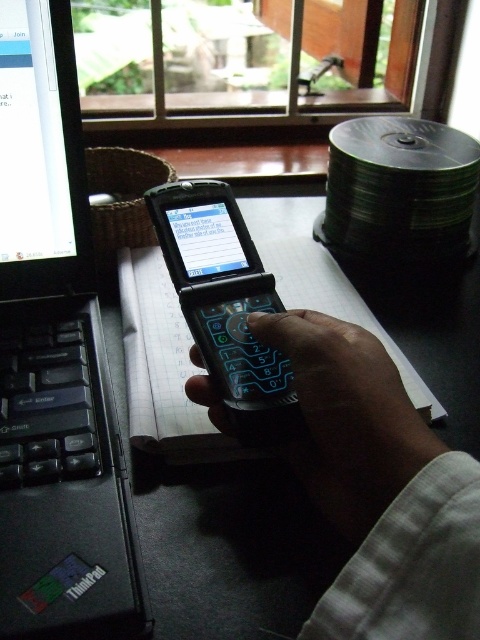
In the scene shown: Is black plastic laptop at left thinner than black plastic phone at center?

No, black plastic laptop at left is not thinner than black plastic phone at center.

Is black plastic laptop at left positioned behind black plastic phone at center?

No, black plastic laptop at left is in front of black plastic phone at center.

Is point (48, 246) behind point (232, 394)?

Yes, point (48, 246) is behind point (232, 394).

Identify the location of black plastic laptop at left. (55, 362).

Between black matte phone at center and black plastic table at center, which one is positioned lower?

black matte phone at center is below.

Consider the image. Which is more to the right, black matte phone at center or black plastic table at center?

black matte phone at center is more to the right.

Is point (321, 365) closer to viewer compared to point (151, 269)?

Yes.

Where is `black matte phone at center`? The image size is (480, 640). black matte phone at center is located at coordinates (348, 417).

Who is taller, black plastic laptop at left or black plastic table at center?

black plastic laptop at left

Does black plastic laptop at left appear on the right side of black plastic table at center?

No, black plastic laptop at left is not to the right of black plastic table at center.

Is point (80, 236) positioned after point (146, 429)?

Yes, point (80, 236) is farther from viewer.

You are a GUI agent. You are given a task and a screenshot of the screen. Output one action in this format:
    pyautogui.click(x=<x>, y=<y>)
    Task: Click on the black plastic laptop at left
    The image size is (480, 640).
    Given the screenshot: What is the action you would take?
    pyautogui.click(x=55, y=362)